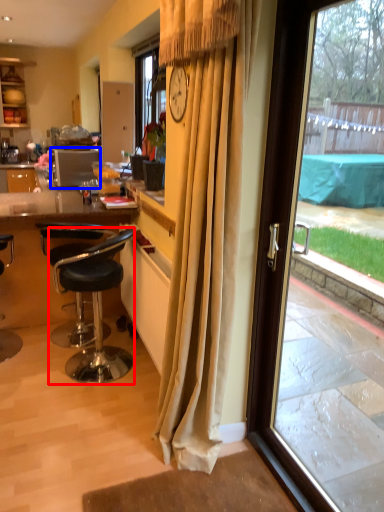
Question: Among these objects, which one is farthest to the camera, chair (highlighted by a red box) or kitchen appliance (highlighted by a blue box)?

Choices:
 (A) chair
 (B) kitchen appliance

Answer: (B)